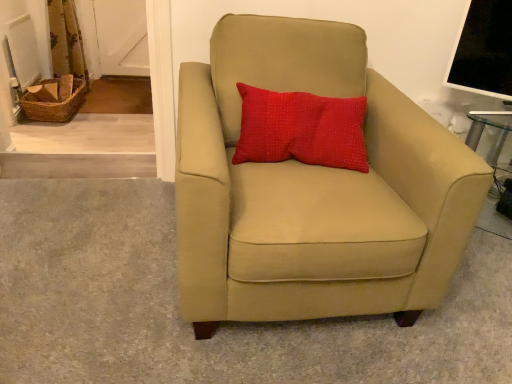
Question: Could floral fabric curtain at upper left be considered to be inside red textured pillow at upper center?

Choices:
 (A) no
 (B) yes

Answer: (A)

Question: Considering the relative sizes of red textured pillow at upper center and floral fabric curtain at upper left in the image provided, is red textured pillow at upper center shorter than floral fabric curtain at upper left?

Choices:
 (A) yes
 (B) no

Answer: (A)

Question: Does red textured pillow at upper center have a smaller size compared to floral fabric curtain at upper left?

Choices:
 (A) yes
 (B) no

Answer: (A)

Question: Is red textured pillow at upper center next to floral fabric curtain at upper left and touching it?

Choices:
 (A) yes
 (B) no

Answer: (B)

Question: Does red textured pillow at upper center have a greater height compared to floral fabric curtain at upper left?

Choices:
 (A) no
 (B) yes

Answer: (A)

Question: Does red textured pillow at upper center appear on the left side of floral fabric curtain at upper left?

Choices:
 (A) yes
 (B) no

Answer: (B)

Question: Is floral fabric curtain at upper left positioned before red textured pillow at upper center?

Choices:
 (A) no
 (B) yes

Answer: (A)

Question: Does floral fabric curtain at upper left have a greater height compared to red textured pillow at upper center?

Choices:
 (A) yes
 (B) no

Answer: (A)

Question: Is floral fabric curtain at upper left positioned behind red textured pillow at upper center?

Choices:
 (A) yes
 (B) no

Answer: (A)

Question: Is floral fabric curtain at upper left bigger than red textured pillow at upper center?

Choices:
 (A) no
 (B) yes

Answer: (B)

Question: Considering the relative positions of floral fabric curtain at upper left and red textured pillow at upper center in the image provided, is floral fabric curtain at upper left to the right of red textured pillow at upper center from the viewer's perspective?

Choices:
 (A) yes
 (B) no

Answer: (B)

Question: Is floral fabric curtain at upper left positioned far away from red textured pillow at upper center?

Choices:
 (A) no
 (B) yes

Answer: (B)

Question: Considering the relative positions of red textured pillow at upper center and suede beige armchair at center in the image provided, is red textured pillow at upper center to the left of suede beige armchair at center from the viewer's perspective?

Choices:
 (A) no
 (B) yes

Answer: (A)